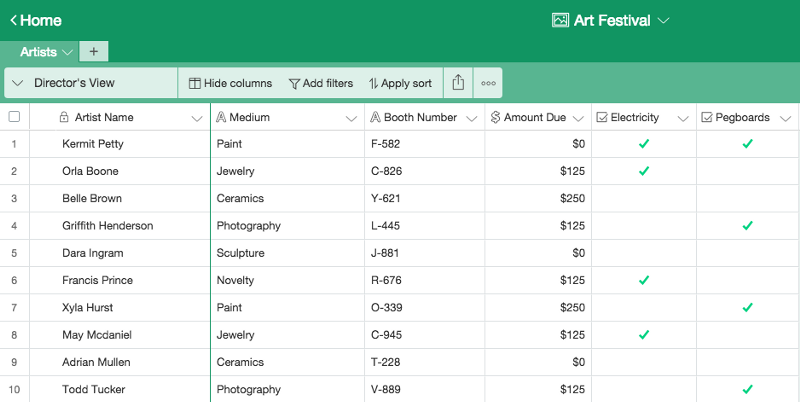
The image size is (800, 402). I want to click on column, so click(12, 115), click(98, 110), click(282, 113), click(428, 121), click(550, 115), click(650, 119), click(748, 117).